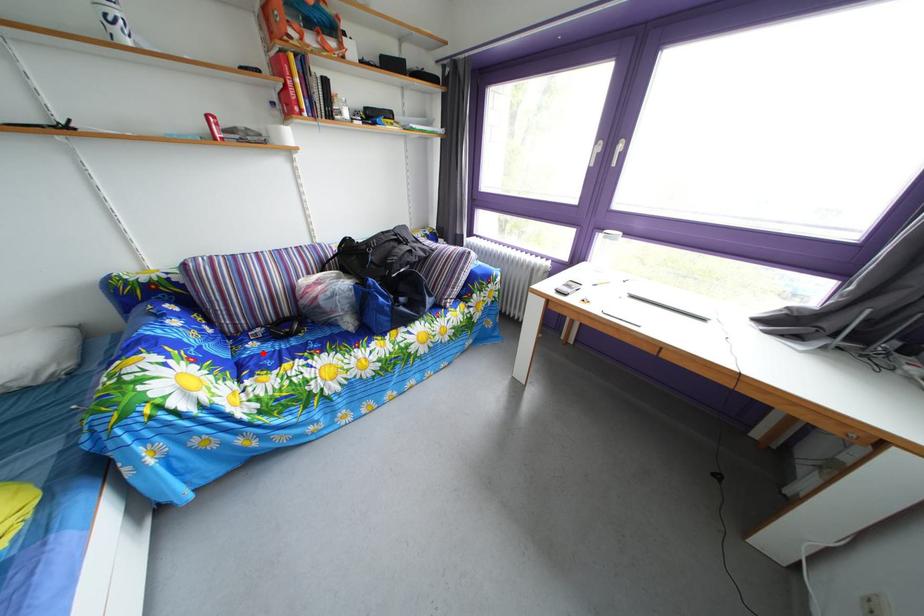
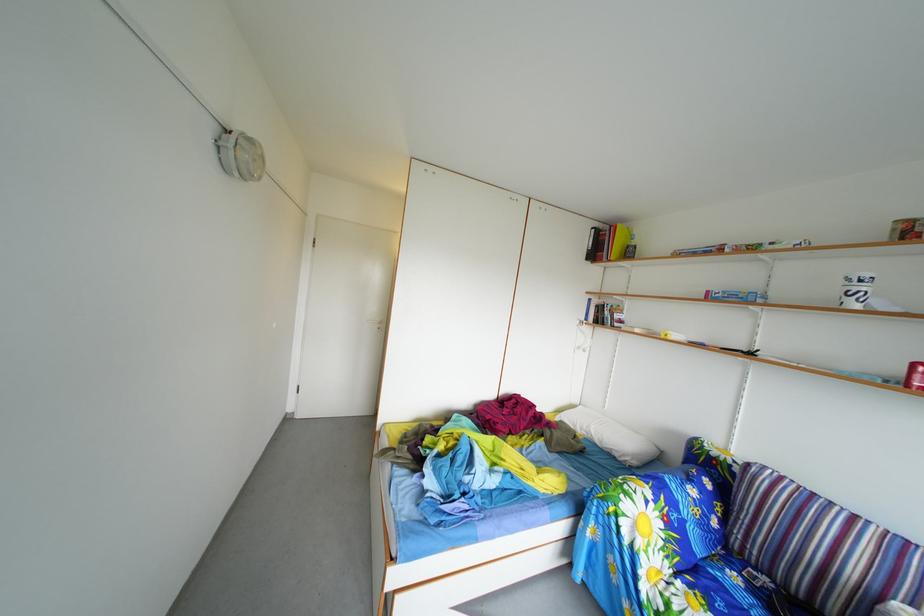
Where in the second image is the point corresponding to the highlighted location from the first image?

(746, 585)